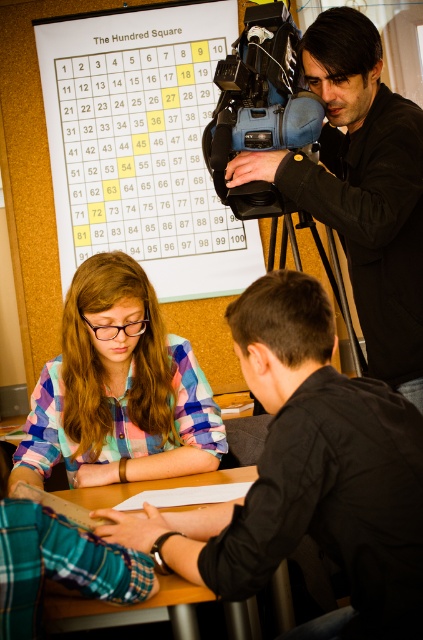
You are standing in the room and want to place a new poster exactly where the white paper at upper center is located. What are the coordinates of that location?

The coordinates of the white paper at upper center are at point (142, 145).